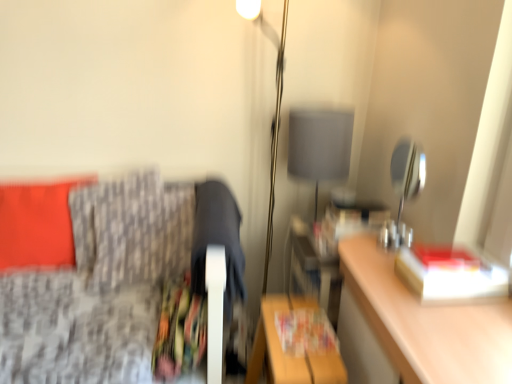
The height and width of the screenshot is (384, 512). What do you see at coordinates (320, 145) in the screenshot?
I see `matte gray lampshade at center, the 2th table lamp when ordered from right to left` at bounding box center [320, 145].

Where is `matte paper magazine at center, the 1th magazine when ordered from right to left`? Image resolution: width=512 pixels, height=384 pixels. matte paper magazine at center, the 1th magazine when ordered from right to left is located at coordinates (351, 221).

The height and width of the screenshot is (384, 512). What do you see at coordinates (37, 224) in the screenshot? I see `matte orange pillow at left, which ranks as the second pillow in right-to-left order` at bounding box center [37, 224].

Identify the location of patterned fabric pillow at left, which is the 1th pillow in right-to-left order. This screenshot has height=384, width=512. (132, 230).

The width and height of the screenshot is (512, 384). Identify the location of wooden table at lower center. (295, 343).

Is patterned fabric couch at left facing towards matte paper magazine at center, the 2th magazine in the front-to-back sequence?

No, patterned fabric couch at left is not oriented towards matte paper magazine at center, the 2th magazine in the front-to-back sequence.

From the image's perspective, between patterned fabric couch at left and matte paper magazine at center, the first magazine viewed from the back, who is located below?

From the image's view, patterned fabric couch at left is below.

In terms of height, does patterned fabric couch at left look taller or shorter compared to matte paper magazine at center, the first magazine viewed from the back?

Clearly, patterned fabric couch at left is taller compared to matte paper magazine at center, the first magazine viewed from the back.

Is point (150, 217) positioned before point (342, 208)?

Yes, it is in front of point (342, 208).

Is hardcover book at right smaller than matte gray lampshade at center, the 2th table lamp in the front-to-back sequence?

Yes, hardcover book at right is smaller than matte gray lampshade at center, the 2th table lamp in the front-to-back sequence.

Is matte gray lampshade at center, placed as the 1th table lamp when sorted from left to right, at the back of hardcover book at right?

hardcover book at right is not turned away from matte gray lampshade at center, placed as the 1th table lamp when sorted from left to right.

Could you measure the distance between hardcover book at right and matte gray lampshade at center, the 2th table lamp in the front-to-back sequence?

hardcover book at right is 22.92 inches from matte gray lampshade at center, the 2th table lamp in the front-to-back sequence.

From a real-world perspective, which object rests below the other?

From a 3D spatial view, hardcover book at right is below.

From the image's perspective, between printed paper magazine at lower center, which ranks as the first magazine in bottom-to-top order, and matte paper magazine at center, the second magazine when ordered from bottom to top, who is located below?

printed paper magazine at lower center, which ranks as the first magazine in bottom-to-top order, appears lower in the image.

Is matte paper magazine at center, the 2th magazine in the front-to-back sequence, completely or partially inside printed paper magazine at lower center, which is the first magazine from front to back?

That's incorrect, matte paper magazine at center, the 2th magazine in the front-to-back sequence, is not inside printed paper magazine at lower center, which is the first magazine from front to back.

The image size is (512, 384). Identify the location of magazine behind the printed paper magazine at lower center, the 2th magazine positioned from the right. (351, 221).

Which is more to the right, printed paper magazine at lower center, which ranks as the first magazine in bottom-to-top order, or matte paper magazine at center, the second magazine when ordered from bottom to top?

matte paper magazine at center, the second magazine when ordered from bottom to top, is more to the right.

Measure the distance from matte orange pillow at left, placed as the first pillow when sorted from left to right, to matte paper magazine at center, the second magazine when ordered from bottom to top.

The distance of matte orange pillow at left, placed as the first pillow when sorted from left to right, from matte paper magazine at center, the second magazine when ordered from bottom to top, is 1.07 meters.

Is matte orange pillow at left, placed as the first pillow when sorted from left to right, behind matte paper magazine at center, the 2th magazine in the front-to-back sequence?

Yes, matte orange pillow at left, placed as the first pillow when sorted from left to right, is further from the camera.

Is point (51, 254) closer or farther from the camera than point (337, 231)?

Point (51, 254).

How different are the orientations of matte orange pillow at left, which ranks as the second pillow in right-to-left order, and matte paper magazine at center, the 1th magazine when ordered from right to left, in degrees?

93.3 degrees separate the facing orientations of matte orange pillow at left, which ranks as the second pillow in right-to-left order, and matte paper magazine at center, the 1th magazine when ordered from right to left.

Considering the positions of objects patterned fabric couch at left and patterned fabric pillow at left, which is the second pillow in left-to-right order, in the image provided, who is more to the right, patterned fabric couch at left or patterned fabric pillow at left, which is the second pillow in left-to-right order,?

Positioned to the right is patterned fabric couch at left.

Considering the positions of point (123, 372) and point (160, 199), is point (123, 372) closer or farther from the camera than point (160, 199)?

Point (123, 372).

From a real-world perspective, which object stands above the other?

patterned fabric couch at left, from a real-world perspective.

From the image's perspective, is patterned fabric couch at left under patterned fabric pillow at left, which is the second pillow in left-to-right order?

Yes, from the image's perspective, patterned fabric couch at left is beneath patterned fabric pillow at left, which is the second pillow in left-to-right order.

How distant is hardcover book at right from metallic gray lampshade at upper right, which is counted as the 2th table lamp, starting from the left?

A distance of 9.22 inches exists between hardcover book at right and metallic gray lampshade at upper right, which is counted as the 2th table lamp, starting from the left.

From a real-world perspective, is hardcover book at right positioned above or below metallic gray lampshade at upper right, which is counted as the 1th table lamp, starting from the front?

hardcover book at right is situated lower than metallic gray lampshade at upper right, which is counted as the 1th table lamp, starting from the front, in the real world.

Is hardcover book at right behind metallic gray lampshade at upper right, which is counted as the 1th table lamp, starting from the front?

No.

Can you confirm if hardcover book at right is positioned to the right of metallic gray lampshade at upper right, positioned as the 2th table lamp in back-to-front order?

Yes.

Is matte paper magazine at center, the 2th magazine in the front-to-back sequence, bigger or smaller than hardcover book at right?

Considering their sizes, matte paper magazine at center, the 2th magazine in the front-to-back sequence, takes up more space than hardcover book at right.

Which is in front, point (338, 219) or point (476, 294)?

The point (476, 294) is more forward.

Between matte paper magazine at center, the 1th magazine when ordered from right to left, and hardcover book at right, which one has less height?

Standing shorter between the two is hardcover book at right.

Where is `magazine lying behind the patterned fabric couch at left`? This screenshot has width=512, height=384. magazine lying behind the patterned fabric couch at left is located at coordinates (351, 221).

Where is `the 2nd table lamp positioned above the hardcover book at right (from the image's perspective)`? the 2nd table lamp positioned above the hardcover book at right (from the image's perspective) is located at coordinates (320, 145).

From the image, which object appears to be farther from patterned fabric pillow at left, which is the 1th pillow in right-to-left order, patterned fabric couch at left or matte orange pillow at left, placed as the first pillow when sorted from left to right?

Among the two, matte orange pillow at left, placed as the first pillow when sorted from left to right, is located further to patterned fabric pillow at left, which is the 1th pillow in right-to-left order.

Which object lies further to the anchor point patterned fabric couch at left, metallic gray lampshade at upper right, which is counted as the 1th table lamp, starting from the front, or wooden table at lower center?

Among the two, metallic gray lampshade at upper right, which is counted as the 1th table lamp, starting from the front, is located further to patterned fabric couch at left.

When comparing their distances from matte orange pillow at left, placed as the first pillow when sorted from left to right, does matte paper magazine at center, which ranks as the 2th magazine in left-to-right order, or hardcover book at right seem further?

hardcover book at right is positioned further to the anchor matte orange pillow at left, placed as the first pillow when sorted from left to right.

When comparing their distances from matte orange pillow at left, which ranks as the second pillow in right-to-left order, does patterned fabric pillow at left, which is the second pillow in left-to-right order, or printed paper magazine at lower center, placed as the 2th magazine when sorted from back to front, seem further?

Based on the image, printed paper magazine at lower center, placed as the 2th magazine when sorted from back to front, appears to be further to matte orange pillow at left, which ranks as the second pillow in right-to-left order.

Looking at the image, which one is located closer to patterned fabric pillow at left, which is the second pillow in left-to-right order, printed paper magazine at lower center, which ranks as the first magazine in bottom-to-top order, or metallic gray lampshade at upper right, which is counted as the 2th table lamp, starting from the left?

The object closer to patterned fabric pillow at left, which is the second pillow in left-to-right order, is printed paper magazine at lower center, which ranks as the first magazine in bottom-to-top order.

Looking at this image, when comparing their distances from hardcover book at right, does matte orange pillow at left, placed as the first pillow when sorted from left to right, or patterned fabric couch at left seem further?

Based on the image, matte orange pillow at left, placed as the first pillow when sorted from left to right, appears to be further to hardcover book at right.

Looking at the image, which one is located closer to wooden table at lower center, patterned fabric couch at left or matte orange pillow at left, placed as the first pillow when sorted from left to right?

patterned fabric couch at left is closer to wooden table at lower center.

Looking at the image, which one is located closer to patterned fabric pillow at left, which is the 1th pillow in right-to-left order, metallic gray lampshade at upper right, which is counted as the 1th table lamp, starting from the front, or matte paper magazine at center, the second magazine when ordered from bottom to top?

matte paper magazine at center, the second magazine when ordered from bottom to top.

Image resolution: width=512 pixels, height=384 pixels. I want to click on table between patterned fabric couch at left and matte paper magazine at center, which ranks as the 2th magazine in left-to-right order, in the horizontal direction, so click(x=295, y=343).

What are the coordinates of `magazine that lies between metallic gray lampshade at upper right, positioned as the first table lamp in right-to-left order, and printed paper magazine at lower center, placed as the 2th magazine when sorted from back to front, from top to bottom` in the screenshot? It's located at (351, 221).

The height and width of the screenshot is (384, 512). What are the coordinates of `book between matte gray lampshade at center, the 2th table lamp when ordered from right to left, and wooden table at lower center from top to bottom` in the screenshot? It's located at (451, 275).

Where is `magazine between matte gray lampshade at center, the 2th table lamp in the front-to-back sequence, and printed paper magazine at lower center, which ranks as the first magazine in bottom-to-top order, in the vertical direction`? This screenshot has width=512, height=384. magazine between matte gray lampshade at center, the 2th table lamp in the front-to-back sequence, and printed paper magazine at lower center, which ranks as the first magazine in bottom-to-top order, in the vertical direction is located at coordinates [x=351, y=221].